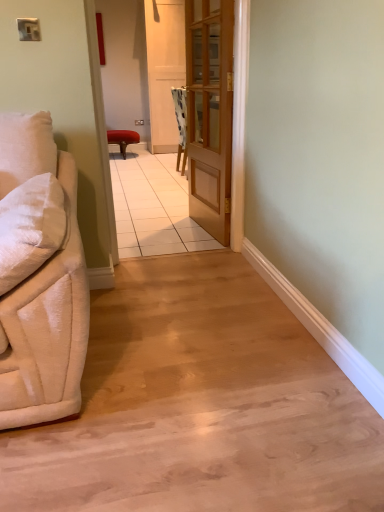
Question: Is wooden door at center inside or outside of matte red stool at center?

Choices:
 (A) inside
 (B) outside

Answer: (B)

Question: Does point (215, 208) appear closer or farther from the camera than point (124, 141)?

Choices:
 (A) farther
 (B) closer

Answer: (B)

Question: Which is farther from the wooden door at center?

Choices:
 (A) velvet beige couch at left
 (B) wooden screen door at center
 (C) matte red stool at center
 (D) wooden door at center

Answer: (A)

Question: Estimate the real-world distances between objects in this image. Which object is farther from the velvet beige couch at left?

Choices:
 (A) matte red stool at center
 (B) wooden door at center
 (C) wooden door at center
 (D) wooden screen door at center

Answer: (B)